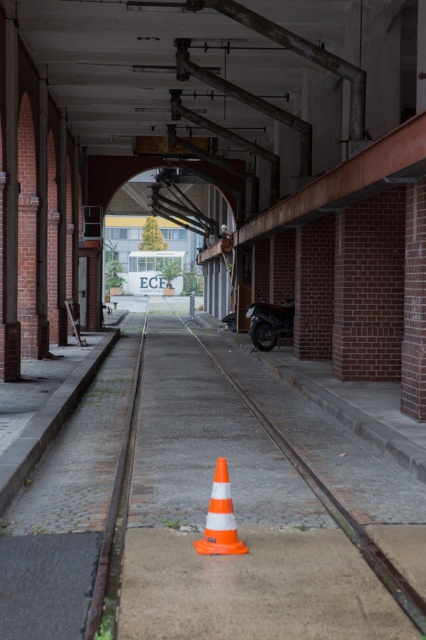
Question: Which point is farther to the camera?

Choices:
 (A) (265, 337)
 (B) (359, 548)

Answer: (A)

Question: Which of the following is the farthest from the observer?

Choices:
 (A) shiny black motorcycle at center
 (B) orange/white striped traffic cone at center
 (C) orange plastic train track at center

Answer: (A)

Question: Can you confirm if orange plastic train track at center is positioned above orange/white striped traffic cone at center?

Choices:
 (A) yes
 (B) no

Answer: (A)

Question: Is orange/white striped traffic cone at center positioned at the back of shiny black motorcycle at center?

Choices:
 (A) no
 (B) yes

Answer: (A)

Question: Does orange plastic train track at center appear on the right side of shiny black motorcycle at center?

Choices:
 (A) no
 (B) yes

Answer: (A)

Question: Which point is closer to the camera?

Choices:
 (A) orange/white striped traffic cone at center
 (B) orange plastic train track at center
 (C) shiny black motorcycle at center

Answer: (B)